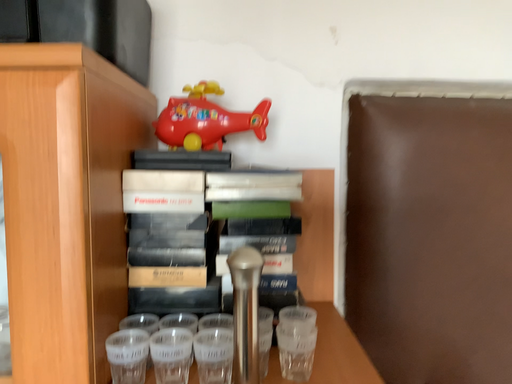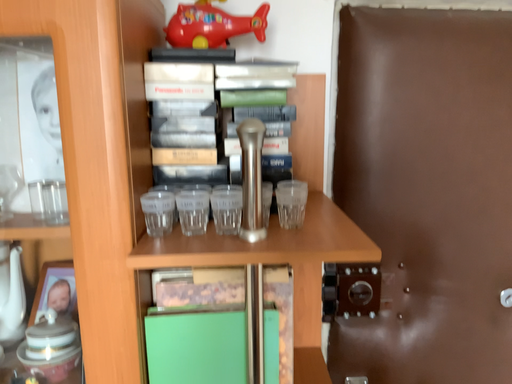
Question: Which way did the camera rotate in the video?

Choices:
 (A) rotated downward
 (B) rotated upward

Answer: (A)